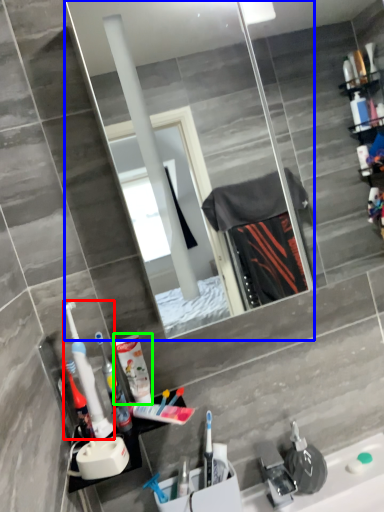
Question: Which object is the farthest from toothbrush (highlighted by a red box)? Choose among these: mirror (highlighted by a blue box) or cleaning product (highlighted by a green box).

Choices:
 (A) mirror
 (B) cleaning product

Answer: (A)